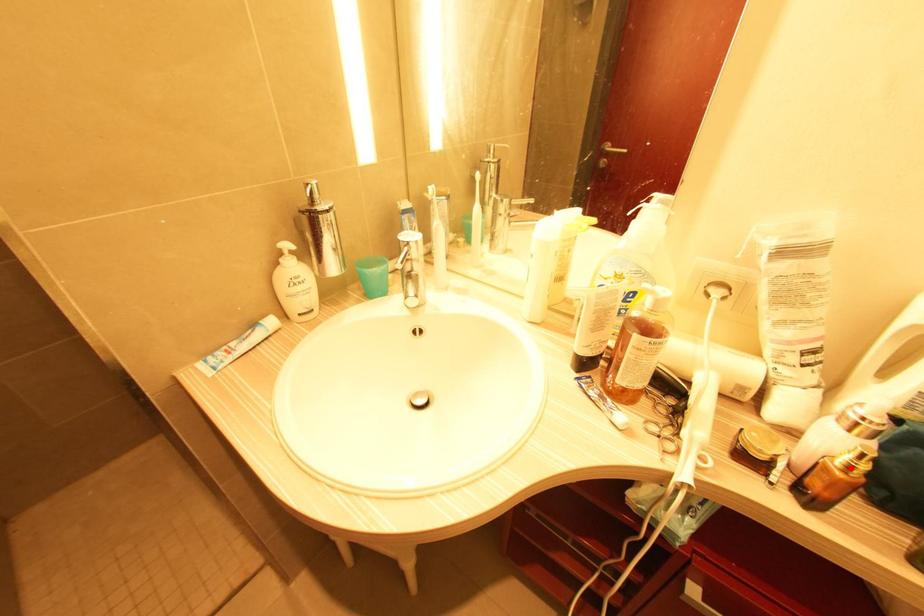
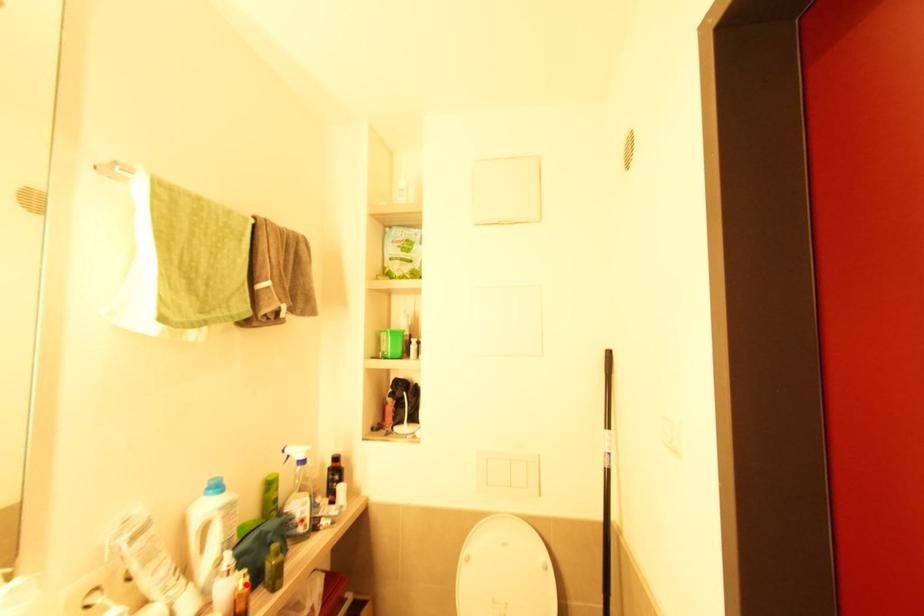
I am providing you with two images of the same scene from different viewpoints. A red point is marked on the first image and another point is marked on the second image. Does the point marked in image1 correspond to the same location as the one in image2?

Yes